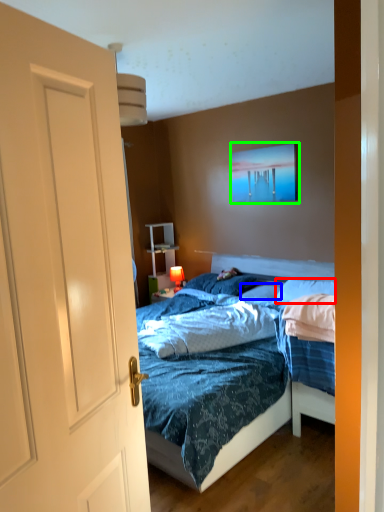
Question: Considering the real-world distances, which object is farthest from pillow (highlighted by a red box)? pillow (highlighted by a blue box) or picture frame (highlighted by a green box)?

Choices:
 (A) pillow
 (B) picture frame

Answer: (B)